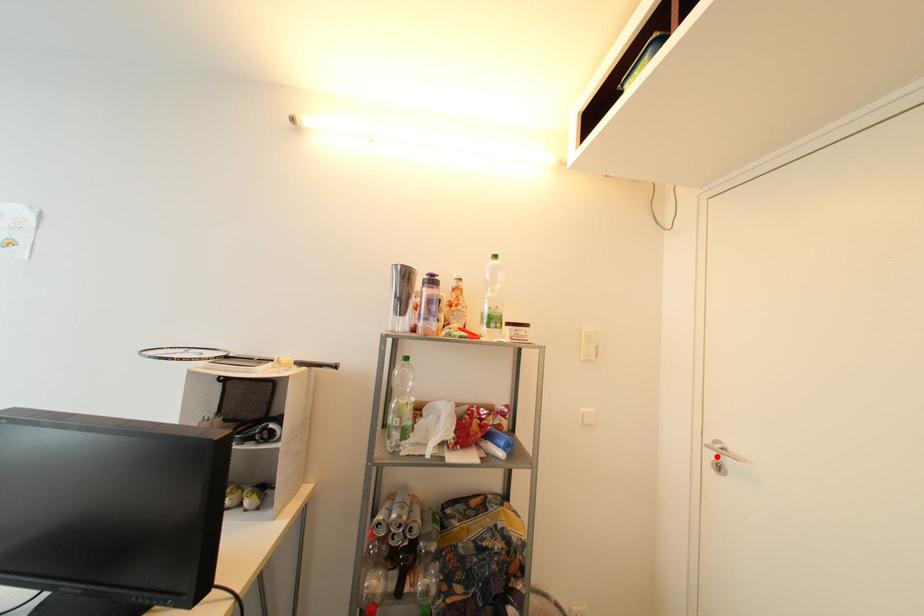
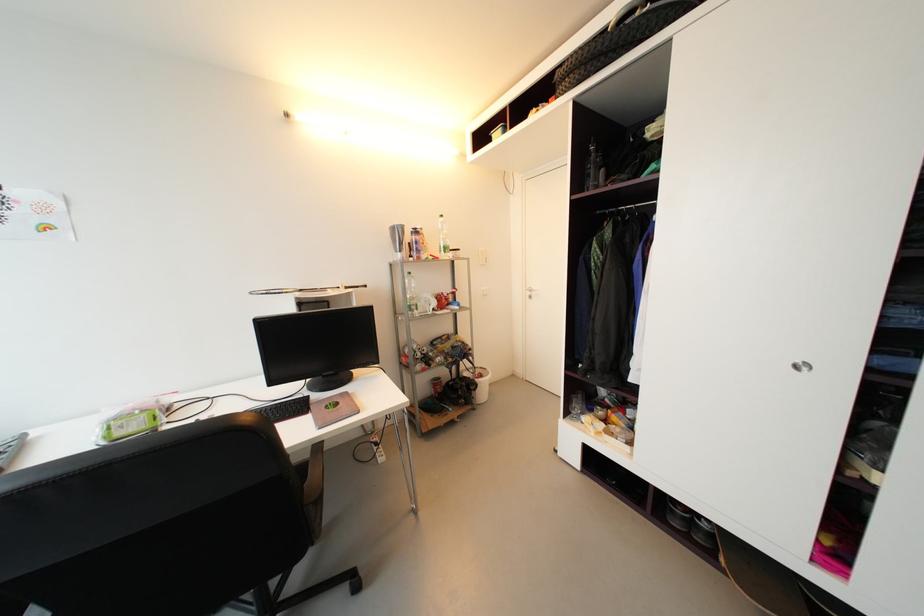
Locate, in the second image, the point that corresponds to the highlighted location in the first image.

(533, 294)